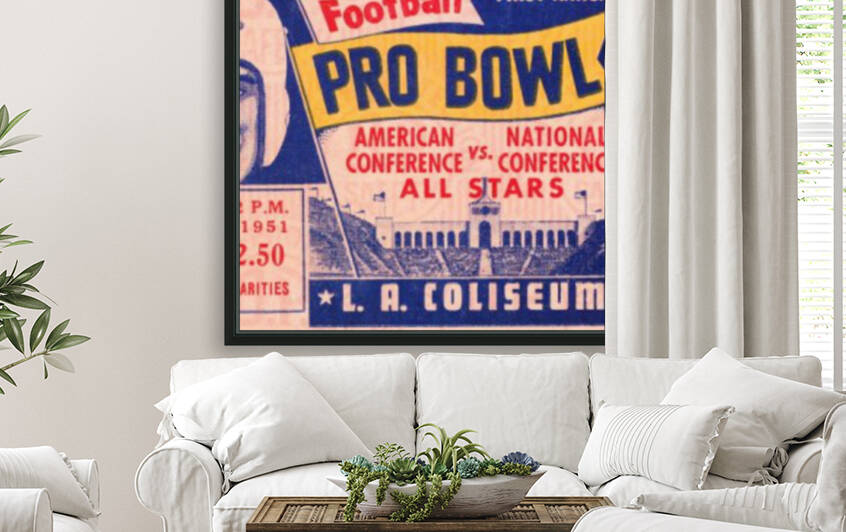
Where is `wall`? wall is located at coordinates (151, 82).